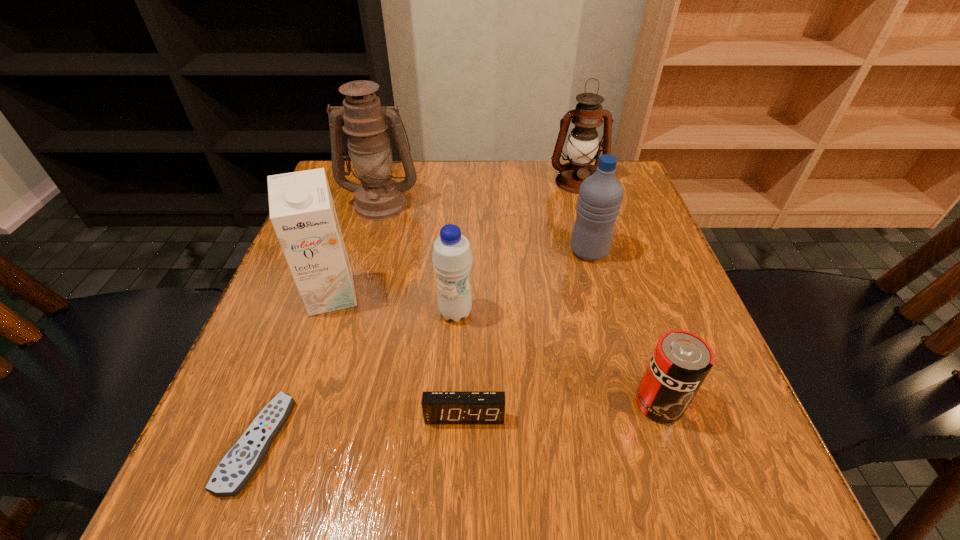
The height and width of the screenshot is (540, 960). I want to click on oil lamp, so (378, 197).

The height and width of the screenshot is (540, 960). Find the location of `lantern`. lantern is located at coordinates (583, 143).

Where is `carton`? The width and height of the screenshot is (960, 540). carton is located at coordinates (302, 212).

The height and width of the screenshot is (540, 960). I want to click on the third farthest object, so click(x=600, y=196).

At what (x,y) coordinates should I click in order to perform the action: click on the farther water bottle. Please return your answer as a coordinate pair (x, y). Image resolution: width=960 pixels, height=540 pixels. Looking at the image, I should click on point(600,196).

Locate an element on the screen. This screenshot has height=540, width=960. the left water bottle is located at coordinates (452, 259).

The image size is (960, 540). Find the location of `the sixth tallest object`. the sixth tallest object is located at coordinates (681, 361).

Where is `alarm clock`? This screenshot has height=540, width=960. alarm clock is located at coordinates (438, 407).

At what (x,y) coordinates should I click in order to perform the action: click on remote control. Please return your answer as a coordinate pair (x, y). The width and height of the screenshot is (960, 540). Looking at the image, I should click on (238, 466).

Locate an element on the screen. The height and width of the screenshot is (540, 960). blank space located on the front of the oil lamp is located at coordinates (370, 242).